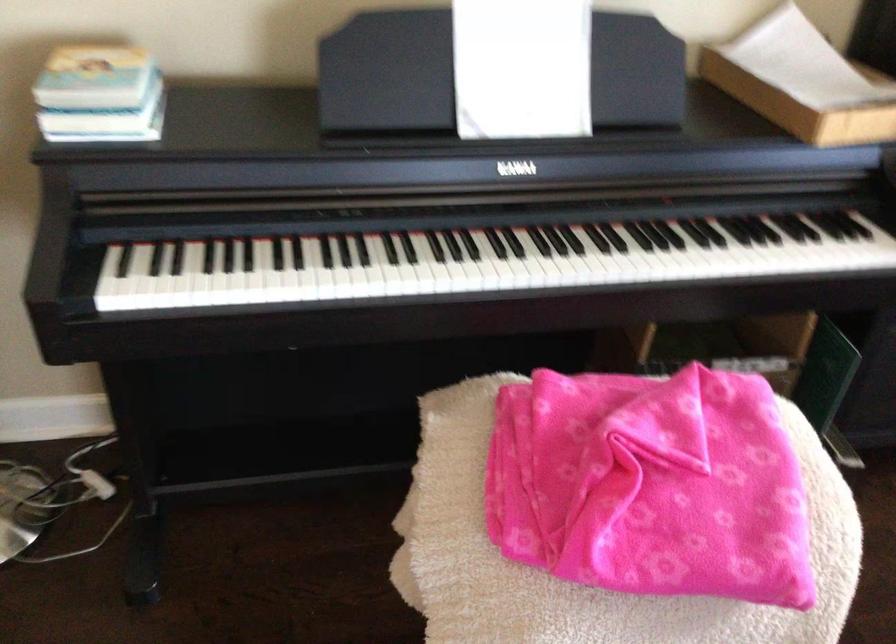
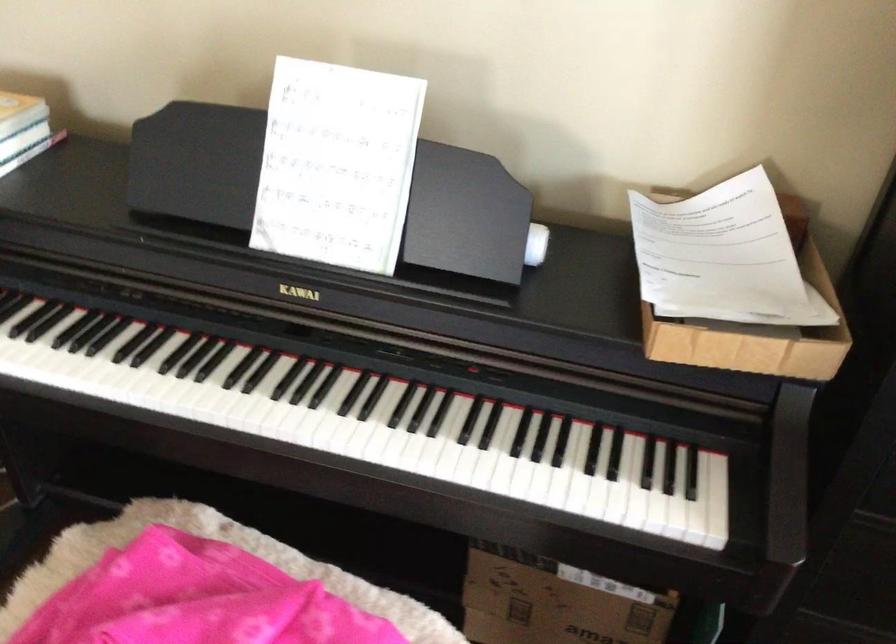
Locate, in the second image, the point that corresponds to point (412, 272) in the first image.

(116, 382)